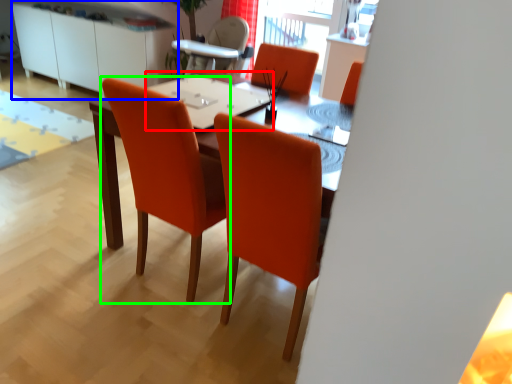
Question: Which object is the closest to the table top (highlighted by a red box)? Choose among these: dresser (highlighted by a blue box) or chair (highlighted by a green box).

Choices:
 (A) dresser
 (B) chair

Answer: (B)